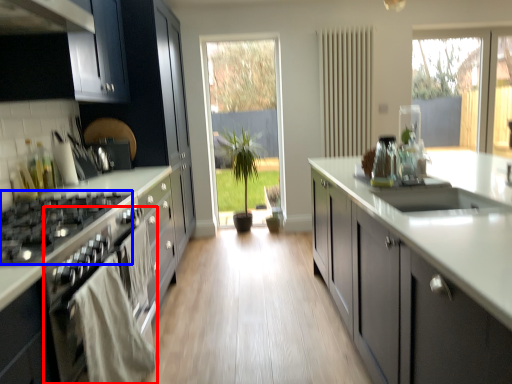
Question: Among these objects, which one is farthest to the camera, oven (highlighted by a red box) or gas stove (highlighted by a blue box)?

Choices:
 (A) oven
 (B) gas stove

Answer: (B)